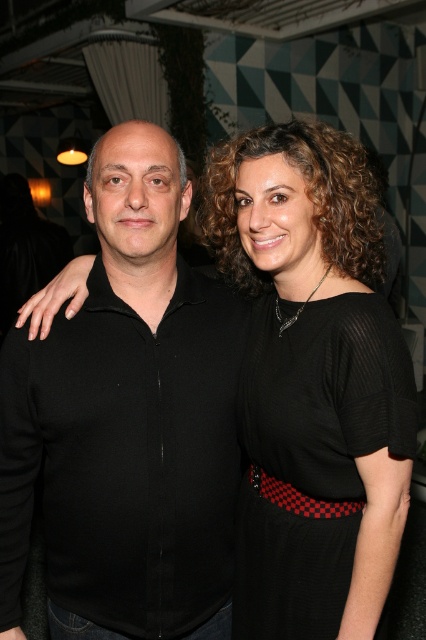
Question: Does black matte shirt at center appear on the left side of black mesh dress at center?

Choices:
 (A) no
 (B) yes

Answer: (B)

Question: Which object appears farthest from the camera in this image?

Choices:
 (A) black mesh dress at center
 (B) black matte shirt at center

Answer: (B)

Question: Which object appears farthest from the camera in this image?

Choices:
 (A) black mesh dress at center
 (B) black matte shirt at center

Answer: (B)

Question: Can you confirm if black matte shirt at center is wider than black mesh dress at center?

Choices:
 (A) yes
 (B) no

Answer: (A)

Question: Observing the image, what is the correct spatial positioning of black matte shirt at center in reference to black mesh dress at center?

Choices:
 (A) right
 (B) left

Answer: (B)